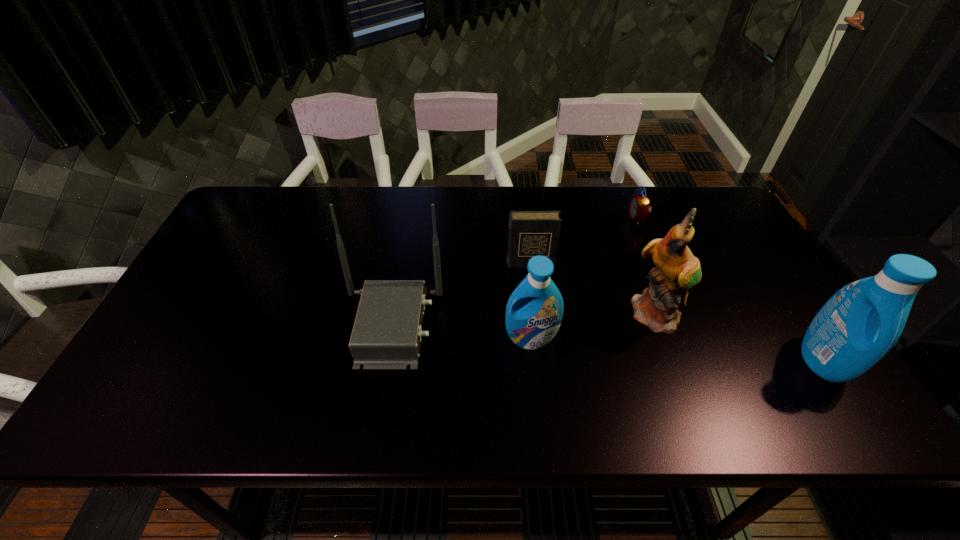
At what (x,y) coordinates should I click in order to perform the action: click on free space between the router and the third shortest object. Please return your answer as a coordinate pair (x, y). The width and height of the screenshot is (960, 540). Looking at the image, I should click on (462, 332).

Identify the location of free space between the parrot and the alarm clock. (648, 267).

I want to click on empty space that is in between the third shortest object and the rightmost object, so click(x=677, y=349).

In order to click on empty location between the parrot and the fifth nearest object in this screenshot , I will do `click(594, 290)`.

Identify the location of vacant space that is in between the shorter detergent and the leftmost object. This screenshot has width=960, height=540. (462, 332).

Identify which object is located as the second nearest to the third shortest object. Please provide its 2D coordinates. Your answer should be formatted as a tuple, i.e. [(x, y)], where the tuple contains the x and y coordinates of a point satisfying the conditions above.

[(677, 270)]

Identify the location of the fifth closest object to the parrot. (387, 331).

Identify the location of free space that satisfies the following two spatial constraints: 1. on the front cover of the diary; 2. on the back of the router to connect cables. (537, 326).

This screenshot has width=960, height=540. Identify the location of free space that satisfies the following two spatial constraints: 1. on the front-facing side of the alarm clock; 2. on the front-facing side of the parrot. (676, 316).

The width and height of the screenshot is (960, 540). Identify the location of free space that satisfies the following two spatial constraints: 1. on the front-facing side of the alarm clock; 2. on the front cover of the diary. (655, 264).